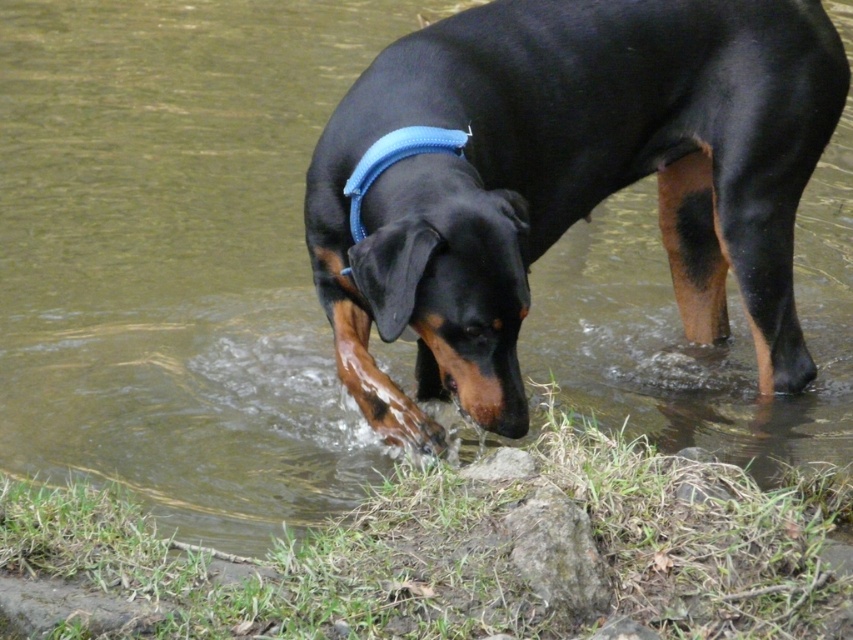
You are a wildlife photographer aiming to capture the black shiny dog at center and the blue fabric neckband at center in your shot. Based on their heights, which one will appear larger in the photo?

The black shiny dog at center is much taller than the blue fabric neckband at center, so it will appear larger in the photo.

From the picture: You are a photographer trying to capture the perfect shot of the black shiny dog at center and the blue fabric neckband at center. Based on the scene, which object is positioned to the right side from your perspective?

The black shiny dog at center is positioned to the right of the blue fabric neckband at center.

What are the coordinates of the black shiny dog at center?

A: The coordinates of the black shiny dog at center are at point (x=567, y=180).